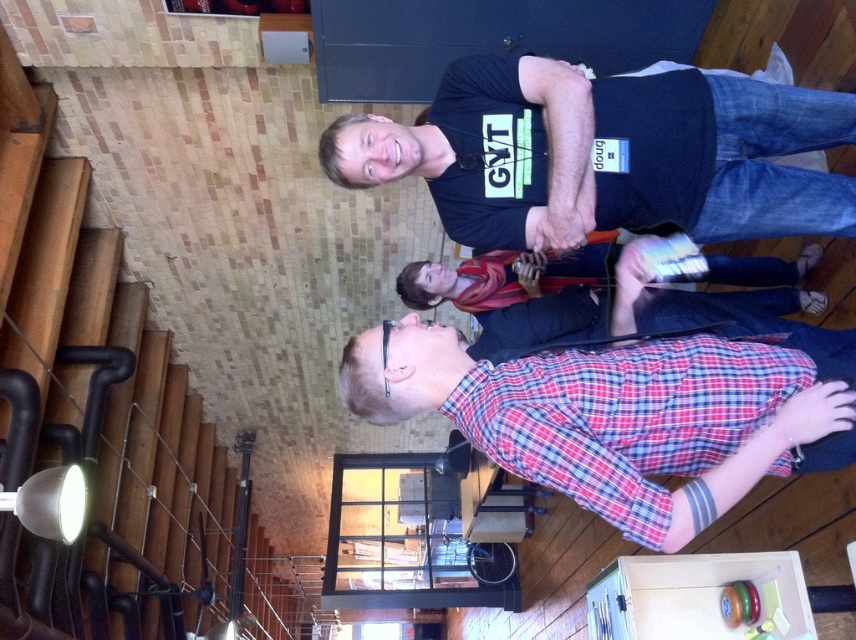
Can you confirm if black cotton t-shirt at upper center is positioned to the left of matte red scarf at center?

No, black cotton t-shirt at upper center is not to the left of matte red scarf at center.

Is black cotton t-shirt at upper center above matte red scarf at center?

Indeed, black cotton t-shirt at upper center is positioned over matte red scarf at center.

Does point (623, 216) lie behind point (728, 273)?

No, (623, 216) is in front of (728, 273).

In order to click on black cotton t-shirt at upper center in this screenshot , I will do [605, 154].

Locate an element on the screen. Image resolution: width=856 pixels, height=640 pixels. black cotton t-shirt at upper center is located at coordinates (605, 154).

Who is more forward, (366,141) or (761,369)?

Point (761,369) is in front.

Find the location of a particular element. black cotton t-shirt at upper center is located at coordinates (605, 154).

Can you confirm if wooden stairs at lower left is wider than black cotton t-shirt at upper center?

Incorrect, wooden stairs at lower left's width does not surpass black cotton t-shirt at upper center's.

Identify the location of wooden stairs at lower left. (107, 211).